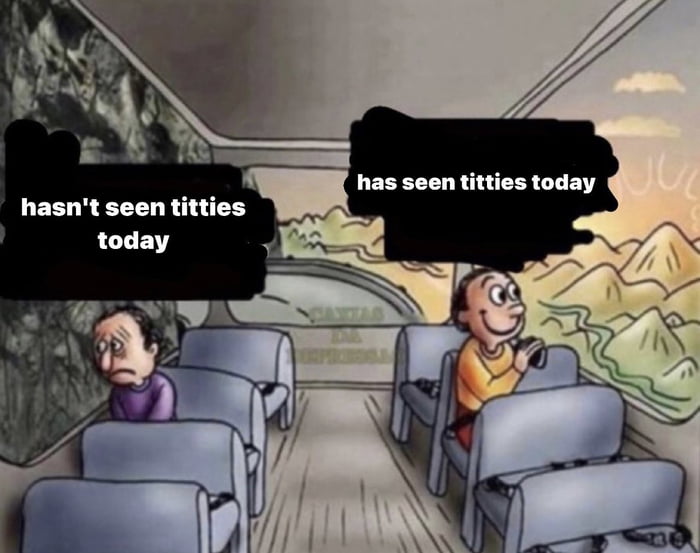
Locate an element on the screen. Image resolution: width=700 pixels, height=553 pixels. floor is located at coordinates (341, 467).